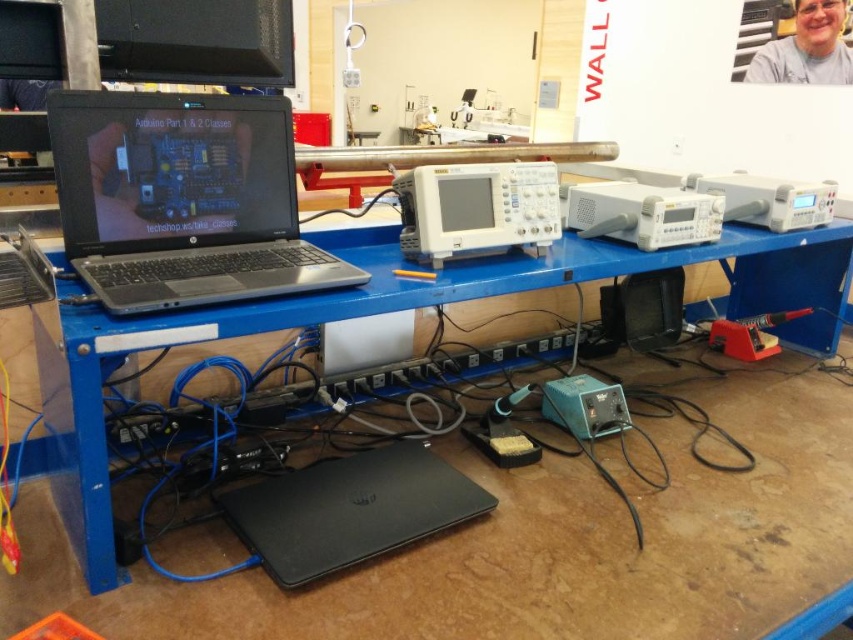
Question: Which object is positioned farthest from the matte black laptop at left?

Choices:
 (A) white plastic oscilloscope at center
 (B) gray t-shirt at upper right
 (C) red plastic soldering iron at lower right

Answer: (B)

Question: Which point is closer to the camera?

Choices:
 (A) black matte laptop at lower center
 (B) white plastic oscilloscope at center

Answer: (A)

Question: Is the position of matte black laptop at left less distant than that of red plastic soldering iron at lower right?

Choices:
 (A) yes
 (B) no

Answer: (A)

Question: Does black matte laptop at lower center have a greater width compared to gray t-shirt at upper right?

Choices:
 (A) no
 (B) yes

Answer: (B)

Question: Does matte black laptop at left appear on the right side of black matte laptop at lower center?

Choices:
 (A) yes
 (B) no

Answer: (B)

Question: Which object is positioned farthest from the red plastic soldering iron at lower right?

Choices:
 (A) black matte laptop at lower center
 (B) gray t-shirt at upper right

Answer: (B)